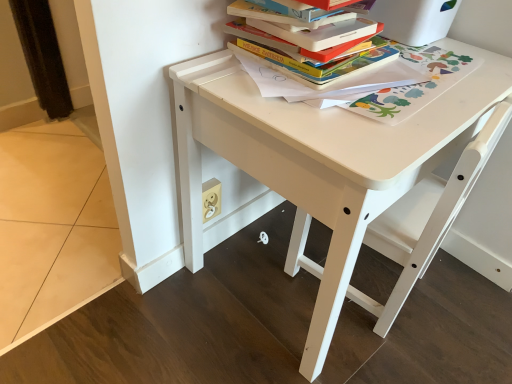
You are a GUI agent. You are given a task and a screenshot of the screen. Output one action in this format:
    pyautogui.click(x=<x>, y=<y>)
    Task: Click on the free space to the right of hardcover books at upper center
    This screenshot has height=384, width=512.
    Given the screenshot: What is the action you would take?
    pyautogui.click(x=443, y=77)